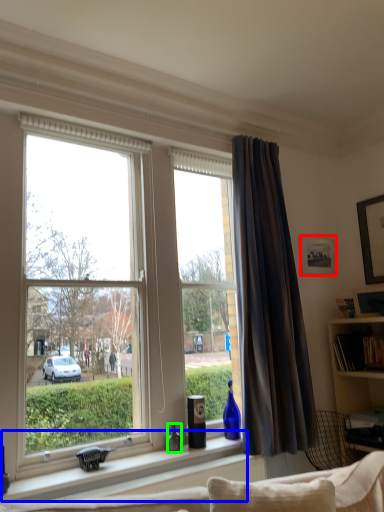
Question: Estimate the real-world distances between objects in this image. Which object is farther from picture frame (highlighted by a red box), window sill (highlighted by a blue box) or bottle (highlighted by a green box)?

Choices:
 (A) window sill
 (B) bottle

Answer: (A)